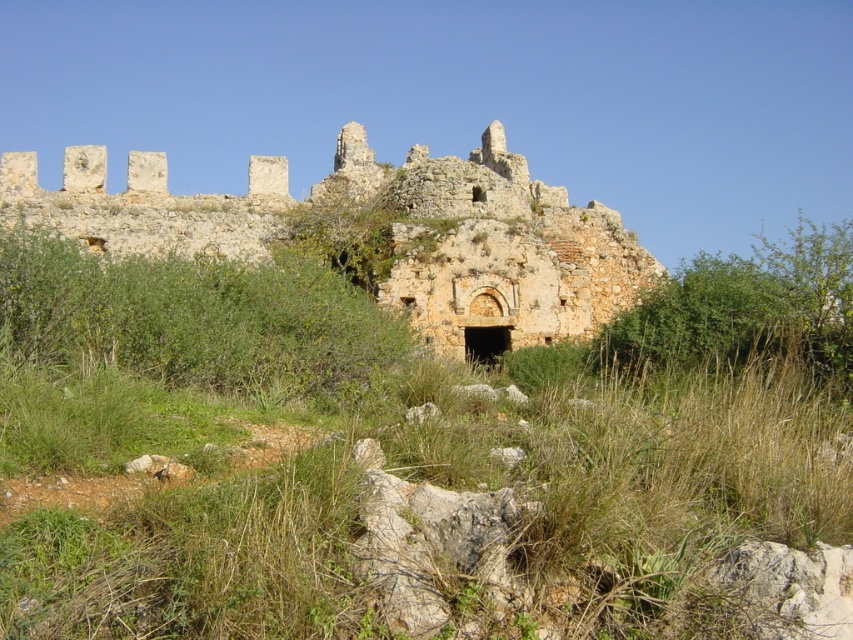
Which is below, green grass at center or green leafy bush at center?

green grass at center is below.

Is green grass at center below green leafy bush at center?

Indeed, green grass at center is positioned under green leafy bush at center.

Is point (479, 493) farther from viewer compared to point (338, 289)?

No, it is not.

The height and width of the screenshot is (640, 853). Find the location of `green grass at center`. green grass at center is located at coordinates (469, 522).

Does point (569, 275) come farther from viewer compared to point (343, 348)?

Yes.

Who is more distant from viewer, (462, 168) or (354, 317)?

The point (462, 168) is behind.

Locate an element on the screen. rustic stone castle at center is located at coordinates pyautogui.click(x=387, y=228).

Who is more forward, (x=177, y=592) or (x=256, y=205)?

Point (x=177, y=592) is more forward.

In the scene shown: Which is more to the right, green grass at center or rustic stone castle at center?

From the viewer's perspective, green grass at center appears more on the right side.

Who is more distant from viewer, (206, 556) or (184, 212)?

The point (184, 212) is more distant.

At what (x,y) coordinates should I click in order to perform the action: click on green grass at center. Please return your answer as a coordinate pair (x, y). The image size is (853, 640). Looking at the image, I should click on (469, 522).